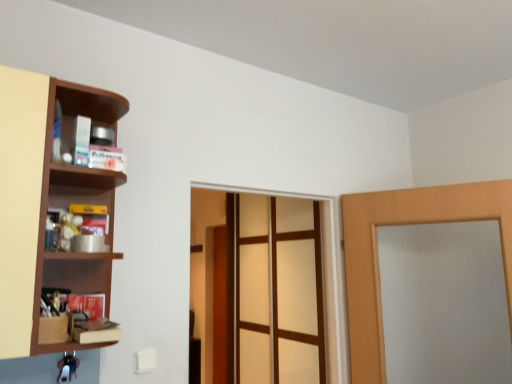
Describe the element at coordinates (45, 201) in the screenshot. The height and width of the screenshot is (384, 512). I see `brown wooden shelf at left` at that location.

I want to click on wooden door at center, which is counted as the 2th door, starting from the front, so click(x=220, y=306).

The width and height of the screenshot is (512, 384). What are the coordinates of `translucent glass screen door at center` in the screenshot? It's located at (279, 291).

At what (x,y) coordinates should I click in order to perform the action: click on brown wooden shelf at left. Please return your answer as a coordinate pair (x, y). Looking at the image, I should click on (45, 201).

Considering the relative sizes of brown wooden shelf at left and wooden door at center, which is counted as the 2th door, starting from the front, in the image provided, is brown wooden shelf at left taller than wooden door at center, which is counted as the 2th door, starting from the front,?

Incorrect, the height of brown wooden shelf at left is not larger of that of wooden door at center, which is counted as the 2th door, starting from the front.

From a real-world perspective, which is physically below, brown wooden shelf at left or wooden door at center, which is counted as the 2th door, starting from the front?

wooden door at center, which is counted as the 2th door, starting from the front, is physically lower.

Find the location of a particular element. the 2nd door directly beneath the brown wooden shelf at left (from a real-world perspective) is located at coordinates click(220, 306).

Based on their positions, is wooden door at center, arranged as the 1th door when viewed from the back, located to the left or right of translucent glass screen door at center?

Clearly, wooden door at center, arranged as the 1th door when viewed from the back, is on the left of translucent glass screen door at center in the image.

Does wooden door at center, arranged as the 1th door when viewed from the back, have a lesser height compared to translucent glass screen door at center?

In fact, wooden door at center, arranged as the 1th door when viewed from the back, may be taller than translucent glass screen door at center.

Would you say wooden door at center, arranged as the 1th door when viewed from the back, is outside translucent glass screen door at center?

wooden door at center, arranged as the 1th door when viewed from the back, lies outside translucent glass screen door at center's area.

Is light brown wooden door at right, the first door viewed from the right, far away from wooden door at center, the 2th door viewed from the right?

Yes, light brown wooden door at right, the first door viewed from the right, and wooden door at center, the 2th door viewed from the right, are located far from each other.

Is light brown wooden door at right, acting as the second door starting from the back, facing away from wooden door at center, the 1th door from the left?

No, wooden door at center, the 1th door from the left, is not at the back of light brown wooden door at right, acting as the second door starting from the back.

From a real-world perspective, is light brown wooden door at right, which is the 1th door in front-to-back order, physically below wooden door at center, arranged as the 1th door when viewed from the back?

Actually, light brown wooden door at right, which is the 1th door in front-to-back order, is physically above wooden door at center, arranged as the 1th door when viewed from the back, in the real world.

Considering the positions of objects light brown wooden door at right, which is the 1th door in front-to-back order, and wooden door at center, which is counted as the 2th door, starting from the front, in the image provided, who is more to the right, light brown wooden door at right, which is the 1th door in front-to-back order, or wooden door at center, which is counted as the 2th door, starting from the front,?

light brown wooden door at right, which is the 1th door in front-to-back order, is more to the right.

Which of these two, brown wooden shelf at left or translucent glass screen door at center, stands taller?

Standing taller between the two is translucent glass screen door at center.

Is there a large distance between brown wooden shelf at left and translucent glass screen door at center?

Indeed, brown wooden shelf at left is not near translucent glass screen door at center.

Consider the image. Is brown wooden shelf at left positioned behind translucent glass screen door at center?

No.

What's the angular difference between brown wooden shelf at left and translucent glass screen door at center's facing directions?

The angle between the facing direction of brown wooden shelf at left and the facing direction of translucent glass screen door at center is 90.1 degrees.

Is point (252, 266) positioned behind point (354, 365)?

Yes, it is behind point (354, 365).

Consider the image. Is light brown wooden door at right, the first door viewed from the right, at the back of translucent glass screen door at center?

No.

How much distance is there between translucent glass screen door at center and light brown wooden door at right, which is the 1th door in front-to-back order?

They are 22.85 inches apart.

From the image's perspective, is translucent glass screen door at center below light brown wooden door at right, which is the 1th door in front-to-back order?

Yes, from the image's perspective, translucent glass screen door at center is beneath light brown wooden door at right, which is the 1th door in front-to-back order.

From the image's perspective, is wooden door at center, the 2th door viewed from the right, located above or below brown wooden shelf at left?

From the image's perspective, wooden door at center, the 2th door viewed from the right, appears below brown wooden shelf at left.

Between wooden door at center, which is counted as the 2th door, starting from the front, and brown wooden shelf at left, which one has less height?

brown wooden shelf at left.

Could you measure the distance between wooden door at center, the 1th door from the left, and brown wooden shelf at left?

A distance of 2.64 meters exists between wooden door at center, the 1th door from the left, and brown wooden shelf at left.

Are wooden door at center, the 2th door viewed from the right, and brown wooden shelf at left located far from each other?

Yes, wooden door at center, the 2th door viewed from the right, and brown wooden shelf at left are located far from each other.

Looking at this image, from a real-world perspective, is wooden door at center, arranged as the 1th door when viewed from the back, located beneath light brown wooden door at right, which is the 1th door in front-to-back order?

Yes, from a real-world perspective, wooden door at center, arranged as the 1th door when viewed from the back, is below light brown wooden door at right, which is the 1th door in front-to-back order.

Considering the relative sizes of wooden door at center, the 1th door from the left, and light brown wooden door at right, acting as the second door starting from the back, in the image provided, is wooden door at center, the 1th door from the left, thinner than light brown wooden door at right, acting as the second door starting from the back,?

No.

Is point (220, 266) positioned before point (362, 287)?

No.

Is wooden door at center, arranged as the 1th door when viewed from the back, taller or shorter than light brown wooden door at right, the first door viewed from the right?

Considering their sizes, wooden door at center, arranged as the 1th door when viewed from the back, has more height than light brown wooden door at right, the first door viewed from the right.

Where is `shelf on the left of wooden door at center, arranged as the 1th door when viewed from the back`? This screenshot has height=384, width=512. shelf on the left of wooden door at center, arranged as the 1th door when viewed from the back is located at coordinates (45, 201).

This screenshot has height=384, width=512. What are the coordinates of `screen door located above the wooden door at center, the 1th door from the left (from a real-world perspective)` in the screenshot? It's located at coord(279,291).

Considering their positions, is translucent glass screen door at center positioned closer to wooden door at center, the 2th door viewed from the right, than light brown wooden door at right, which is the 1th door in front-to-back order?

translucent glass screen door at center lies closer to wooden door at center, the 2th door viewed from the right, than the other object.

Looking at the image, which one is located closer to translucent glass screen door at center, light brown wooden door at right, the first door viewed from the right, or brown wooden shelf at left?

light brown wooden door at right, the first door viewed from the right, is positioned closer to the anchor translucent glass screen door at center.

Which object lies nearer to the anchor point light brown wooden door at right, positioned as the 2th door in left-to-right order, translucent glass screen door at center or brown wooden shelf at left?

translucent glass screen door at center.

Looking at the image, which one is located closer to brown wooden shelf at left, translucent glass screen door at center or light brown wooden door at right, positioned as the 2th door in left-to-right order?

light brown wooden door at right, positioned as the 2th door in left-to-right order, is positioned closer to the anchor brown wooden shelf at left.

Looking at the image, which one is located further to translucent glass screen door at center, brown wooden shelf at left or wooden door at center, the 2th door viewed from the right?

Among the two, brown wooden shelf at left is located further to translucent glass screen door at center.

Based on their spatial positions, is brown wooden shelf at left or translucent glass screen door at center further from light brown wooden door at right, positioned as the 2th door in left-to-right order?

The object further to light brown wooden door at right, positioned as the 2th door in left-to-right order, is brown wooden shelf at left.

Considering their positions, is translucent glass screen door at center positioned further to wooden door at center, the 2th door viewed from the right, than brown wooden shelf at left?

brown wooden shelf at left lies further to wooden door at center, the 2th door viewed from the right, than the other object.

Which object lies further to the anchor point light brown wooden door at right, the first door viewed from the right, brown wooden shelf at left or wooden door at center, the 2th door viewed from the right?

The object further to light brown wooden door at right, the first door viewed from the right, is wooden door at center, the 2th door viewed from the right.

The height and width of the screenshot is (384, 512). I want to click on screen door between brown wooden shelf at left and wooden door at center, the 2th door viewed from the right, along the z-axis, so click(279, 291).

Where is `door positioned between brown wooden shelf at left and wooden door at center, which is counted as the 2th door, starting from the front, from near to far`? door positioned between brown wooden shelf at left and wooden door at center, which is counted as the 2th door, starting from the front, from near to far is located at coordinates (378, 259).

This screenshot has width=512, height=384. I want to click on screen door between brown wooden shelf at left and light brown wooden door at right, acting as the second door starting from the back, in the horizontal direction, so click(279, 291).

At what (x,y) coordinates should I click in order to perform the action: click on screen door located between light brown wooden door at right, the first door viewed from the right, and wooden door at center, the 1th door from the left, in the depth direction. Please return your answer as a coordinate pair (x, y). The height and width of the screenshot is (384, 512). Looking at the image, I should click on (279, 291).